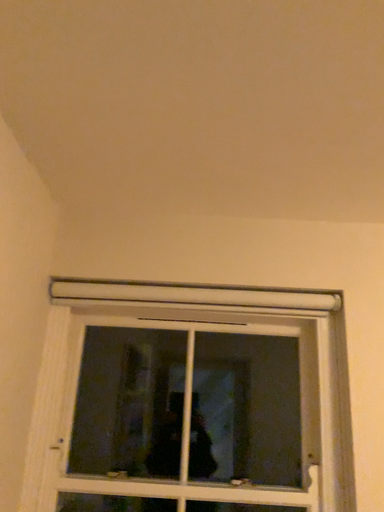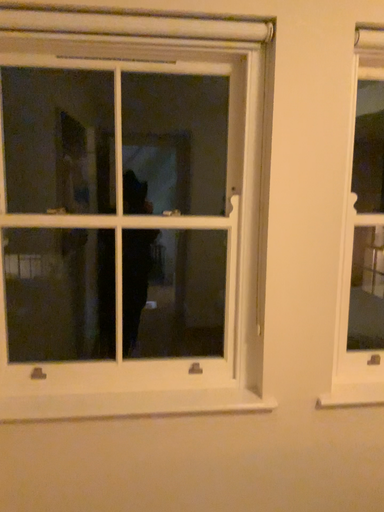
Question: How did the camera likely rotate when shooting the video?

Choices:
 (A) rotated right
 (B) rotated left

Answer: (A)